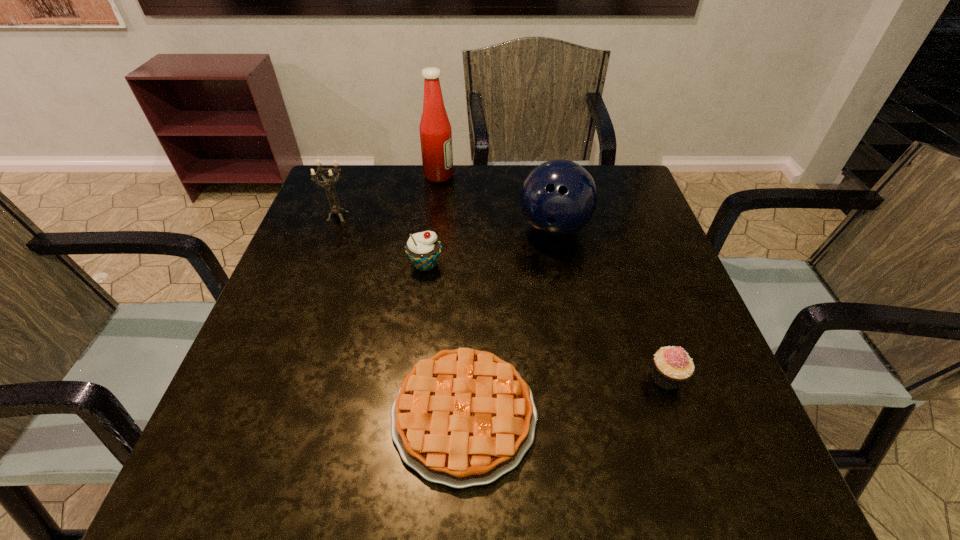
The image size is (960, 540). Find the location of `free location located on the front-facing side of the tallest object`. free location located on the front-facing side of the tallest object is located at coordinates (482, 176).

Identify the location of free space located 0.120m on the surface of the second tallest object near the finger holes. The image size is (960, 540). (565, 290).

Where is `free region located 0.130m on the back of the candle holder`? Image resolution: width=960 pixels, height=540 pixels. free region located 0.130m on the back of the candle holder is located at coordinates (350, 181).

Find the location of a particular element. This screenshot has width=960, height=540. vacant space located on the left of the farther cupcake is located at coordinates (350, 264).

This screenshot has width=960, height=540. What are the coordinates of `vacant area located 0.150m on the left of the shorter cupcake` in the screenshot? It's located at (564, 378).

Identify the location of free location located on the back of the shortest object. (468, 296).

Where is `condiment that is at the far edge`? The width and height of the screenshot is (960, 540). condiment that is at the far edge is located at coordinates (435, 130).

At what (x,y) coordinates should I click in order to perform the action: click on bowling ball located at the far edge. Please return your answer as a coordinate pair (x, y). Image resolution: width=960 pixels, height=540 pixels. Looking at the image, I should click on (558, 198).

This screenshot has height=540, width=960. What are the coordinates of `candle holder at the far edge` in the screenshot? It's located at (335, 208).

This screenshot has height=540, width=960. I want to click on object at the near edge, so click(x=462, y=418).